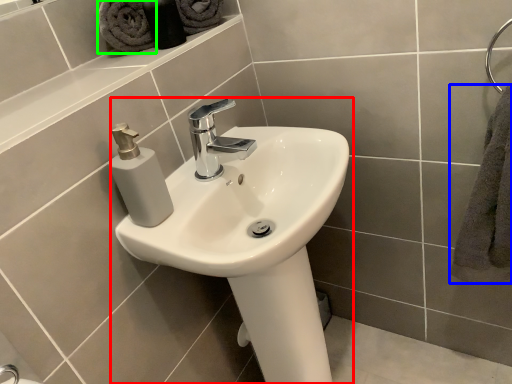
Question: Which object is positioned farthest from sink (highlighted by a red box)? Select from bath towel (highlighted by a blue box) and bath towel (highlighted by a green box).

Choices:
 (A) bath towel
 (B) bath towel

Answer: (B)